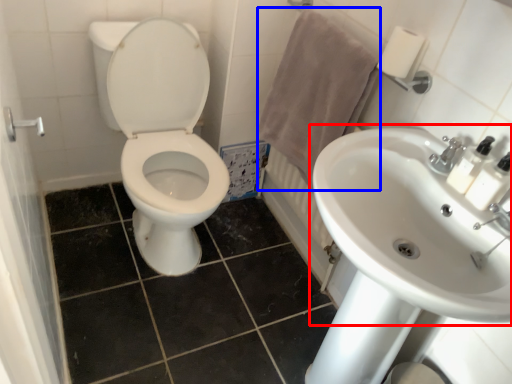
Question: Which of the following is the farthest to the observer, sink (highlighted by a red box) or bath towel (highlighted by a blue box)?

Choices:
 (A) sink
 (B) bath towel

Answer: (B)